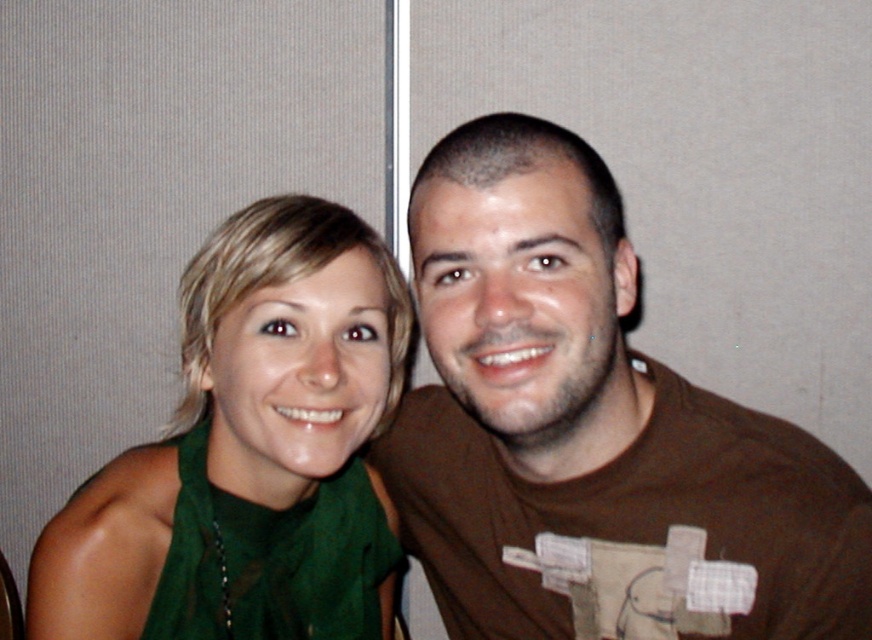
Question: Does brown cotton t-shirt at center appear over green matte scarf at left?

Choices:
 (A) yes
 (B) no

Answer: (B)

Question: Among these points, which one is farthest from the camera?

Choices:
 (A) (649, 465)
 (B) (314, 266)

Answer: (B)

Question: Considering the relative positions of brown cotton t-shirt at center and green matte scarf at left in the image provided, where is brown cotton t-shirt at center located with respect to green matte scarf at left?

Choices:
 (A) above
 (B) below

Answer: (B)

Question: Which point is farther to the camera?

Choices:
 (A) (821, 445)
 (B) (346, 408)

Answer: (B)

Question: Is brown cotton t-shirt at center to the right of green matte scarf at left from the viewer's perspective?

Choices:
 (A) yes
 (B) no

Answer: (A)

Question: Among these objects, which one is farthest from the camera?

Choices:
 (A) green matte scarf at left
 (B) brown cotton t-shirt at center

Answer: (A)